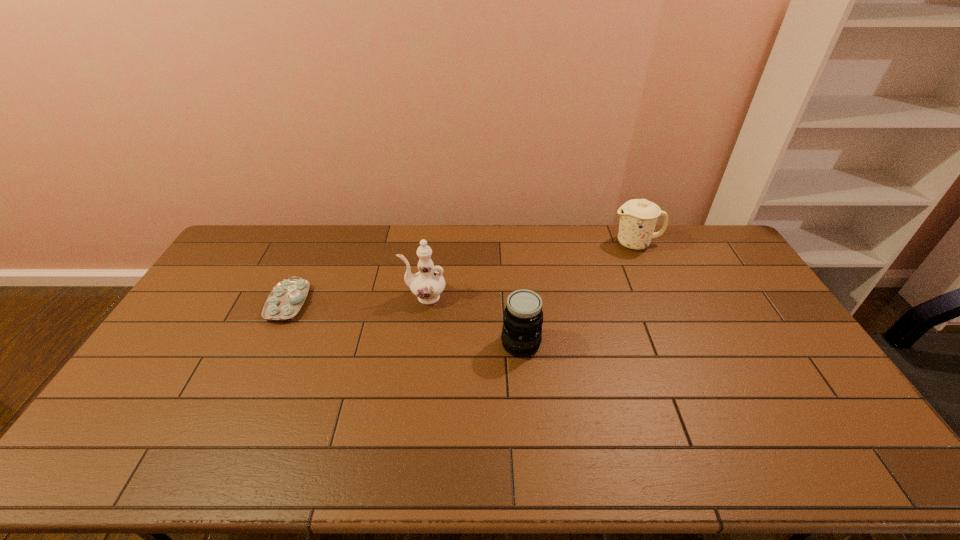
You are a GUI agent. You are given a task and a screenshot of the screen. Output one action in this format:
    pyautogui.click(x=<x>, y=<y>)
    Task: Click on the tallest chinaware
    This screenshot has height=540, width=960.
    Given the screenshot: What is the action you would take?
    pyautogui.click(x=427, y=284)

Locate an element on the screen. the second object from left to right is located at coordinates (427, 284).

Where is `the rightmost chinaware`? The height and width of the screenshot is (540, 960). the rightmost chinaware is located at coordinates (638, 217).

In order to click on the second tallest chinaware in this screenshot , I will do `click(638, 217)`.

I want to click on the nearest object, so click(x=521, y=336).

Locate an element on the screen. the second object from right to left is located at coordinates (521, 336).

At what (x,y) coordinates should I click in order to perform the action: click on the leftmost object. Please return your answer as a coordinate pair (x, y). Looking at the image, I should click on (286, 299).

Locate an element on the screen. Image resolution: width=960 pixels, height=540 pixels. the shortest object is located at coordinates (286, 299).

This screenshot has height=540, width=960. I want to click on free region located at the spout of the second chinaware from left to right, so click(343, 296).

Locate an element on the screen. This screenshot has width=960, height=540. vacant space located at the spout of the second chinaware from left to right is located at coordinates (322, 296).